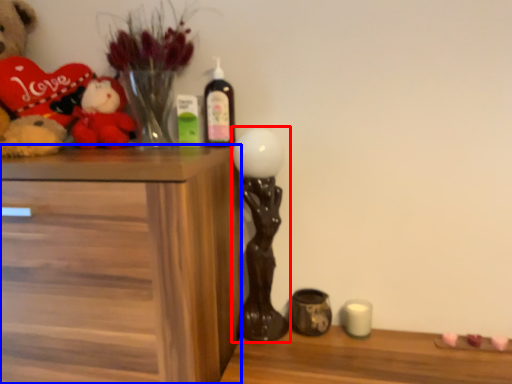
Question: Which of the following is the closest to the observer, candle holder (highlighted by a red box) or chest of drawers (highlighted by a blue box)?

Choices:
 (A) candle holder
 (B) chest of drawers

Answer: (B)